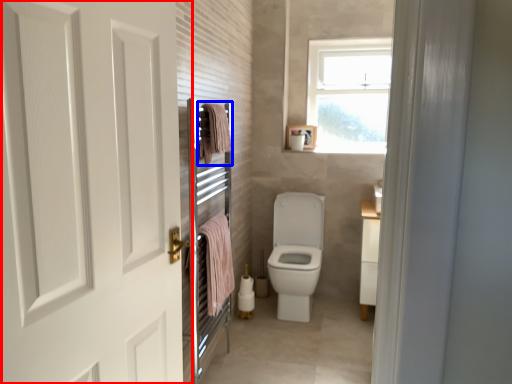
Question: Which object appears closest to the camera in this image, door (highlighted by a red box) or bath towel (highlighted by a blue box)?

Choices:
 (A) door
 (B) bath towel

Answer: (A)